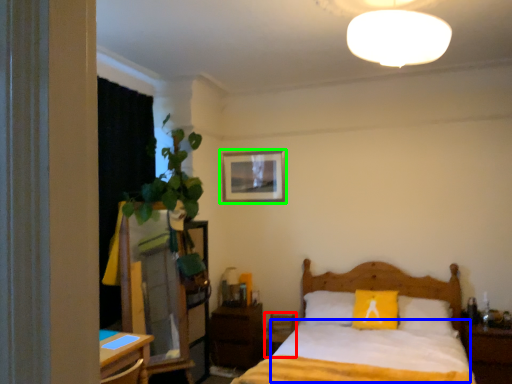
Question: Which is nearer to the armchair (highlighted by a red box)? sheet (highlighted by a blue box) or picture frame (highlighted by a green box).

Choices:
 (A) sheet
 (B) picture frame

Answer: (A)